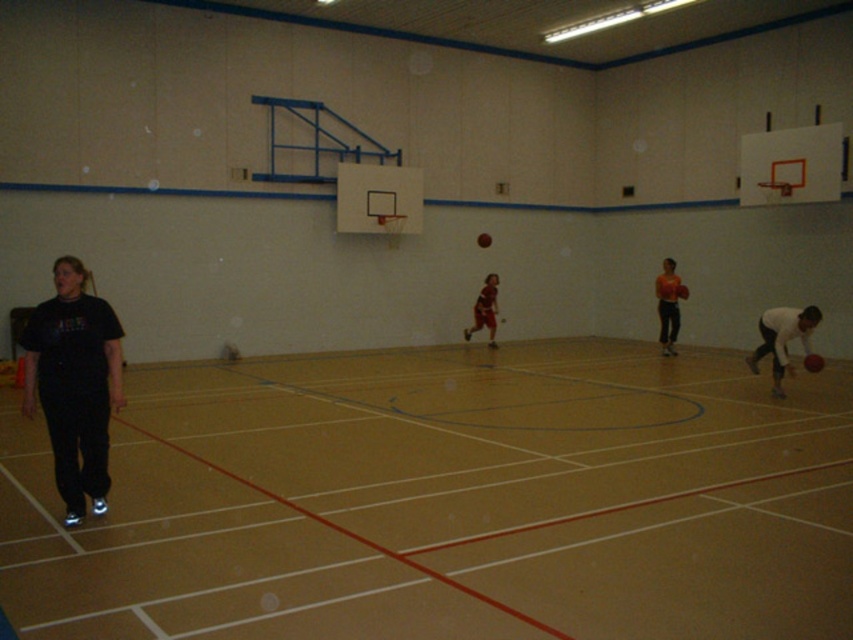
Question: Is brown rubber basketball court at center thinner than white matte basketball player at lower right?

Choices:
 (A) no
 (B) yes

Answer: (A)

Question: Which point is farther to the camera?

Choices:
 (A) black matte t-shirt at left
 (B) orange matte basketball player at center

Answer: (B)

Question: Among these points, which one is farthest from the camera?

Choices:
 (A) (807, 355)
 (B) (782, 339)
 (C) (74, 381)
 (D) (492, 328)

Answer: (D)

Question: Is black matte t-shirt at left positioned at the back of matte brown shorts at center?

Choices:
 (A) yes
 (B) no

Answer: (B)

Question: Can you confirm if orange matte basketball player at center is positioned below shiny red basketball at lower right?

Choices:
 (A) no
 (B) yes

Answer: (A)

Question: Which of the following is the closest to the observer?

Choices:
 (A) (810, 364)
 (B) (419, 611)

Answer: (B)